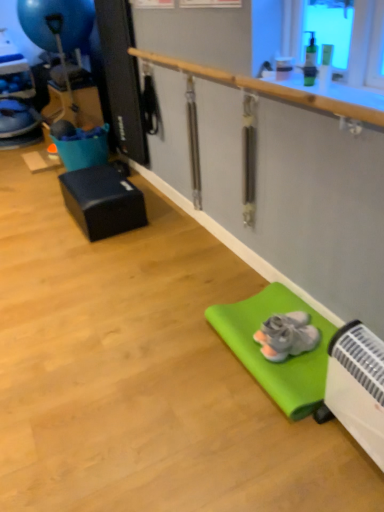
Question: Could you tell me if blue rubber balloon at upper left is turned towards green rubber yoga mat at lower right?

Choices:
 (A) yes
 (B) no

Answer: (B)

Question: Is the depth of blue rubber balloon at upper left less than that of green rubber yoga mat at lower right?

Choices:
 (A) yes
 (B) no

Answer: (B)

Question: Is blue rubber balloon at upper left to the right of green rubber yoga mat at lower right from the viewer's perspective?

Choices:
 (A) no
 (B) yes

Answer: (A)

Question: From a real-world perspective, is blue rubber balloon at upper left physically above green rubber yoga mat at lower right?

Choices:
 (A) no
 (B) yes

Answer: (B)

Question: Is blue rubber balloon at upper left looking in the opposite direction of green rubber yoga mat at lower right?

Choices:
 (A) yes
 (B) no

Answer: (B)

Question: Is wooden rail at upper center in front of or behind gray suede sneakers at lower right in the image?

Choices:
 (A) front
 (B) behind

Answer: (A)

Question: Visually, is wooden rail at upper center positioned to the left or to the right of gray suede sneakers at lower right?

Choices:
 (A) right
 (B) left

Answer: (B)

Question: In terms of height, does wooden rail at upper center look taller or shorter compared to gray suede sneakers at lower right?

Choices:
 (A) tall
 (B) short

Answer: (A)

Question: From the image's perspective, relative to gray suede sneakers at lower right, is wooden rail at upper center above or below?

Choices:
 (A) above
 (B) below

Answer: (A)

Question: In the image, is wooden rail at upper center on the left side or the right side of green rubber yoga mat at lower right?

Choices:
 (A) left
 (B) right

Answer: (A)

Question: In terms of height, does wooden rail at upper center look taller or shorter compared to green rubber yoga mat at lower right?

Choices:
 (A) tall
 (B) short

Answer: (A)

Question: In terms of width, does wooden rail at upper center look wider or thinner when compared to green rubber yoga mat at lower right?

Choices:
 (A) wide
 (B) thin

Answer: (B)

Question: Is wooden rail at upper center in front of or behind green rubber yoga mat at lower right in the image?

Choices:
 (A) front
 (B) behind

Answer: (A)

Question: Considering the positions of black matte cube at left and wooden rail at upper center in the image, is black matte cube at left taller or shorter than wooden rail at upper center?

Choices:
 (A) tall
 (B) short

Answer: (A)

Question: Is black matte cube at left bigger or smaller than wooden rail at upper center?

Choices:
 (A) small
 (B) big

Answer: (B)